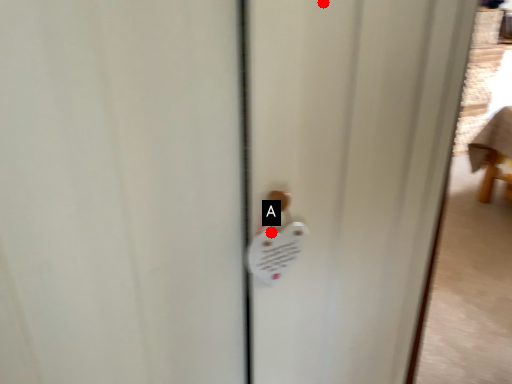
Question: Two points are circled on the image, labeled by A and B beside each circle. Which point is closer to the camera?

Choices:
 (A) A is closer
 (B) B is closer

Answer: (B)